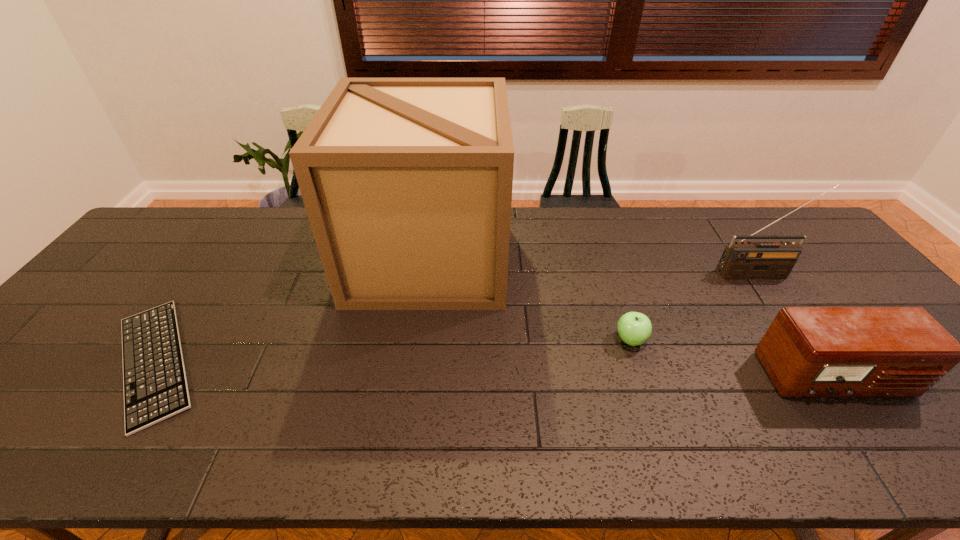
Image resolution: width=960 pixels, height=540 pixels. I want to click on vacant space situated on the reinforced sides of the tallest object, so click(x=612, y=256).

Image resolution: width=960 pixels, height=540 pixels. In order to click on vacant space positioned 0.090m on the front-facing side of the fourth shortest object in this screenshot , I will do `click(775, 302)`.

This screenshot has width=960, height=540. I want to click on vacant space located on the front-facing side of the nearer radio receiver, so click(x=892, y=457).

Where is `vacant space situated 0.180m on the left of the third object from left to right`? vacant space situated 0.180m on the left of the third object from left to right is located at coordinates (543, 340).

Where is `free point located 0.400m on the right of the shortest object`? Image resolution: width=960 pixels, height=540 pixels. free point located 0.400m on the right of the shortest object is located at coordinates (383, 361).

I want to click on object that is positioned at the far edge, so click(407, 182).

The height and width of the screenshot is (540, 960). In order to click on object located in the near edge section of the desktop in this screenshot , I will do `click(155, 386)`.

Image resolution: width=960 pixels, height=540 pixels. Identify the location of object that is positioned at the left edge. click(x=155, y=386).

Where is `object that is at the right edge`? The image size is (960, 540). object that is at the right edge is located at coordinates (807, 351).

The height and width of the screenshot is (540, 960). What are the coordinates of `object that is at the near left corner` in the screenshot? It's located at (155, 386).